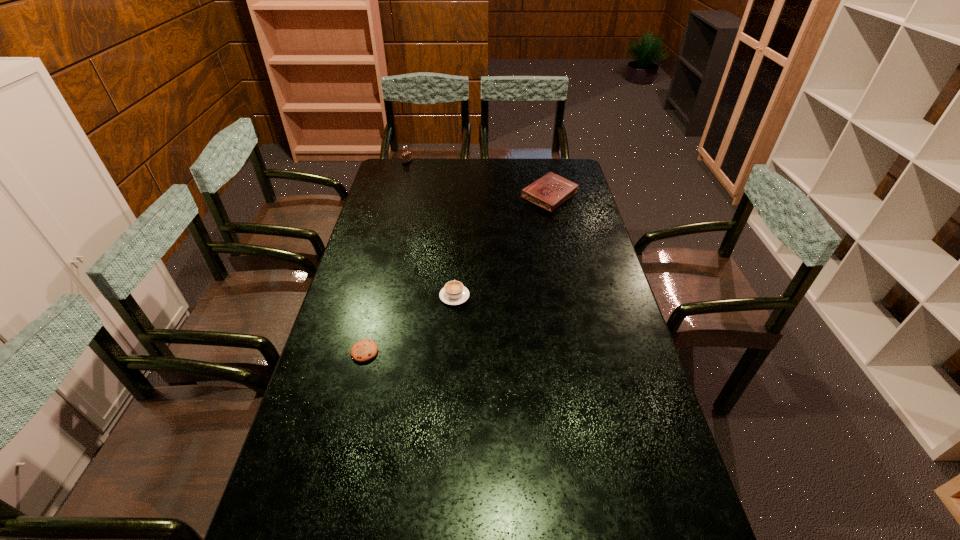
The width and height of the screenshot is (960, 540). Identify the location of object at the far right corner. (550, 191).

In the image, there is a desktop. Find the location of `free space at the far edge`. free space at the far edge is located at coordinates (427, 159).

Where is `free space at the left edge`? free space at the left edge is located at coordinates (322, 415).

Image resolution: width=960 pixels, height=540 pixels. In order to click on vacant area at the right edge in this screenshot , I will do `click(599, 355)`.

Identify the location of vacant position at the far left corner of the desktop. (410, 167).

Where is `vacant point located between the second nearest object and the shortest object`? This screenshot has height=540, width=960. vacant point located between the second nearest object and the shortest object is located at coordinates (409, 324).

This screenshot has width=960, height=540. I want to click on free space between the tallest object and the second nearest object, so click(x=431, y=230).

Identify the location of empty space between the farthest object and the second object from right to left. This screenshot has height=540, width=960. (431, 230).

Locate an element on the screen. blank region between the cappuccino and the hardback book is located at coordinates (502, 246).

Where is `blank region between the cookie and the second object from right to left`? blank region between the cookie and the second object from right to left is located at coordinates (409, 324).